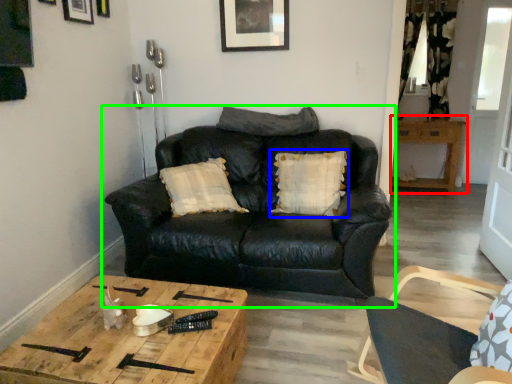
Question: Which object is the closest to the table (highlighted by a red box)? Choose among these: pillow (highlighted by a blue box) or studio couch (highlighted by a green box).

Choices:
 (A) pillow
 (B) studio couch

Answer: (A)